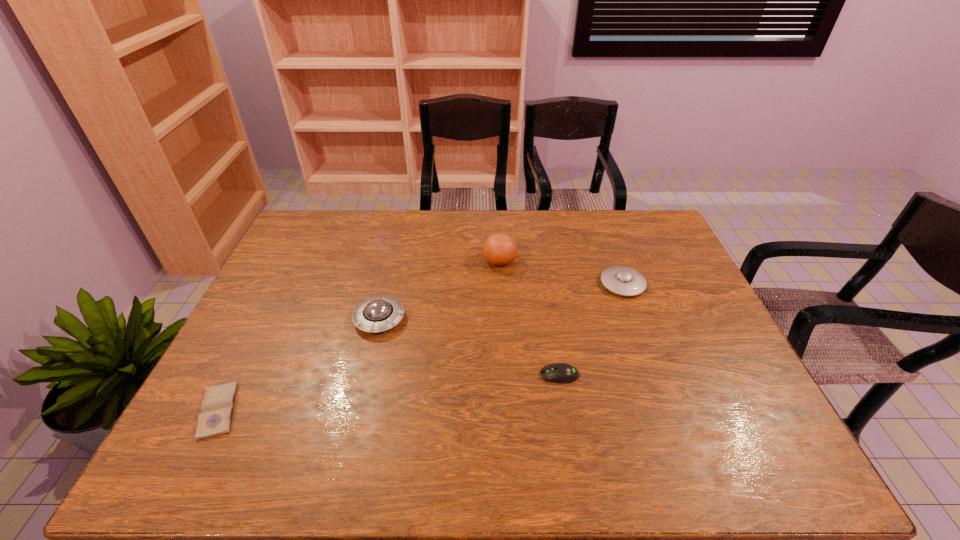
Locate an element on the screen. vacant space located 0.210m on the left of the third object from right to left is located at coordinates (419, 260).

At what (x,y) coordinates should I click in order to perform the action: click on free spot located on the left of the left saucer. Please return your answer as a coordinate pair (x, y). Looking at the image, I should click on (337, 319).

In order to click on blank space located on the back of the right saucer in this screenshot , I will do `click(612, 255)`.

Locate an element on the screen. The width and height of the screenshot is (960, 540). free location located 0.390m on the wheel side of the second nearest object is located at coordinates (386, 375).

Locate an element on the screen. vacant area located 0.400m on the wheel side of the second nearest object is located at coordinates (382, 375).

Find the location of a particular element. vacant position located on the wheel side of the second nearest object is located at coordinates (445, 375).

This screenshot has height=540, width=960. What are the coordinates of `vacant region located 0.060m on the right of the nearest object` in the screenshot? It's located at (266, 411).

This screenshot has height=540, width=960. I want to click on object that is at the near edge, so click(215, 418).

You are a GUI agent. You are given a task and a screenshot of the screen. Output one action in this format:
    pyautogui.click(x=<x>, y=<y>)
    Task: Click on the object at the left edge
    
    Given the screenshot: What is the action you would take?
    pyautogui.click(x=215, y=418)

Locate an element on the screen. object that is at the right edge is located at coordinates (620, 280).